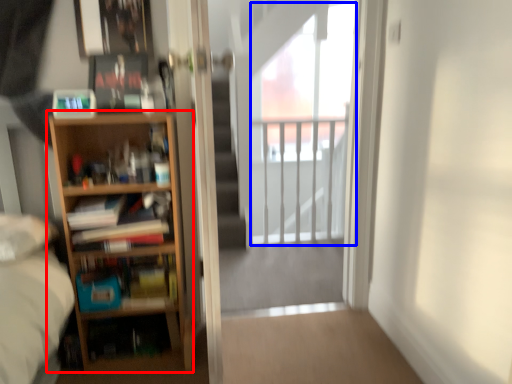
Question: Which object is closer to the camera taking this photo, bookcase (highlighted by a red box) or window (highlighted by a blue box)?

Choices:
 (A) bookcase
 (B) window

Answer: (A)